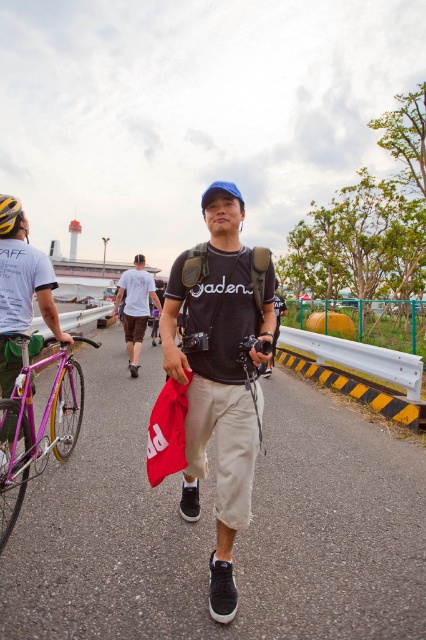
Who is lower down, khaki cotton pants at center or purple metallic bicycle at left?

Positioned lower is purple metallic bicycle at left.

Describe the element at coordinates (221, 371) in the screenshot. Image resolution: width=426 pixels, height=640 pixels. I see `khaki cotton pants at center` at that location.

Locate an element on the screen. The width and height of the screenshot is (426, 640). khaki cotton pants at center is located at coordinates (221, 371).

Does purple metallic bicycle at left appear on the right side of metallic purple bicycle at left?

In fact, purple metallic bicycle at left is to the left of metallic purple bicycle at left.

Does purple metallic bicycle at left come behind metallic purple bicycle at left?

No, purple metallic bicycle at left is in front of metallic purple bicycle at left.

Is point (2, 515) positioned before point (17, 252)?

Yes, it is.

Where is `purple metallic bicycle at left`? This screenshot has height=640, width=426. purple metallic bicycle at left is located at coordinates (40, 424).

Which of these two, khaki cotton pants at center or white cotton t-shirt at center, stands taller?

With more height is khaki cotton pants at center.

Is khaki cotton pants at center positioned at the back of white cotton t-shirt at center?

That is False.

I want to click on khaki cotton pants at center, so click(x=221, y=371).

Where is `khaki cotton pants at center`? khaki cotton pants at center is located at coordinates (221, 371).